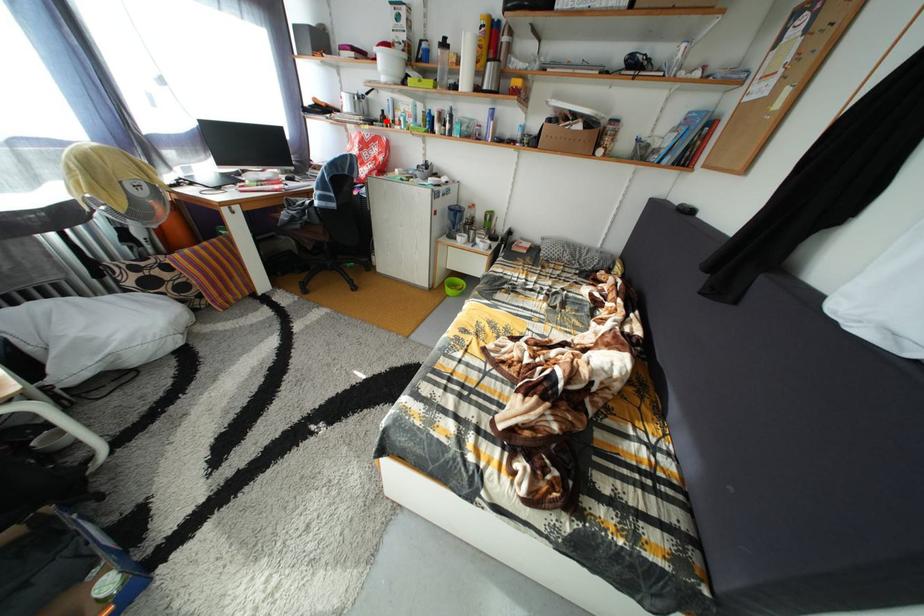
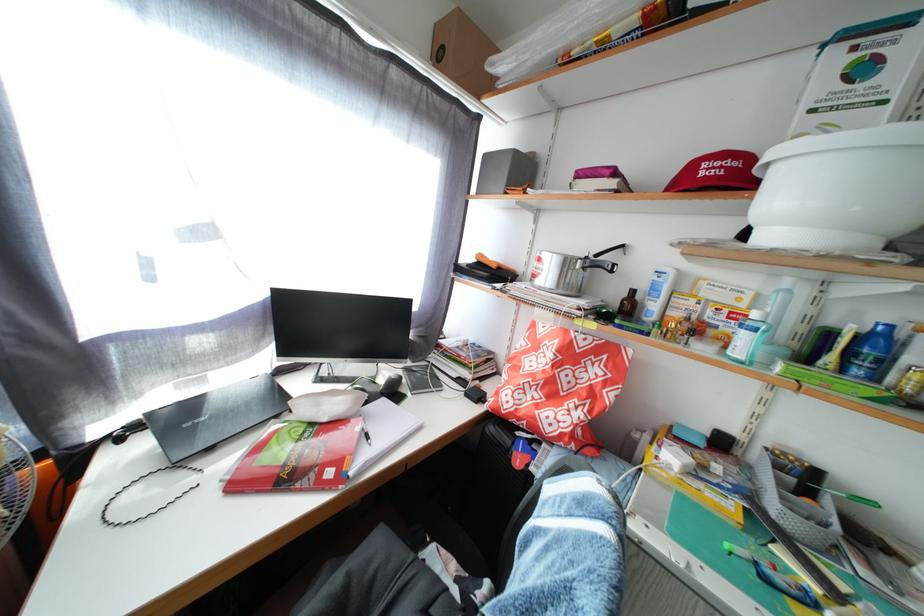
The point at the highlighted location is marked in the first image. Where is the corresponding point in the second image?

(621, 301)